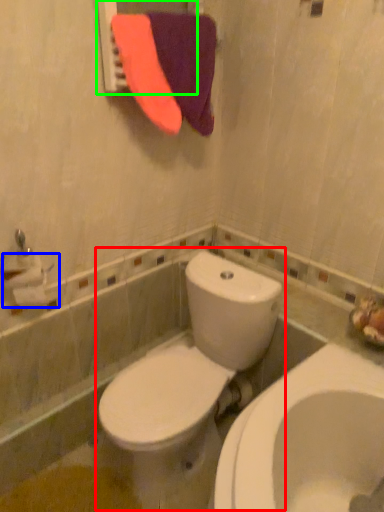
Question: Estimate the real-world distances between objects in this image. Which object is farther from toilet (highlighted by a red box), toilet paper (highlighted by a blue box) or mirror (highlighted by a green box)?

Choices:
 (A) toilet paper
 (B) mirror

Answer: (B)